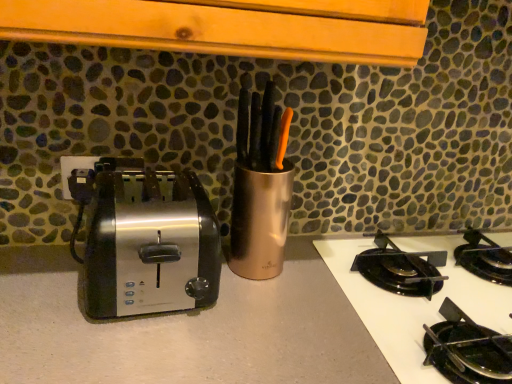
This screenshot has width=512, height=384. Find the location of `satin finish countertop at center`. satin finish countertop at center is located at coordinates (185, 329).

The height and width of the screenshot is (384, 512). I want to click on satin metallic toaster at left, so click(x=144, y=238).

In order to click on counter top in front of the satin metallic toaster at left in this screenshot , I will do `click(185, 329)`.

Which object is closer to the camera taking this photo, satin metallic toaster at left or satin finish countertop at center?

satin finish countertop at center is closer to the camera.

Choose the correct answer: Is satin metallic toaster at left inside satin finish countertop at center or outside it?

The correct answer is: outside.

Could you tell me if black glass cooktop at lower right is facing satin metallic toaster at left?

No.

From the picture: From the image's perspective, which one is positioned higher, black glass cooktop at lower right or satin metallic toaster at left?

satin metallic toaster at left, from the image's perspective.

Can you confirm if black glass cooktop at lower right is shorter than satin metallic toaster at left?

Indeed, black glass cooktop at lower right has a lesser height compared to satin metallic toaster at left.

How different are the orientations of satin finish countertop at center and satin metallic toaster at left in degrees?

satin finish countertop at center and satin metallic toaster at left are facing 0.00133 degrees away from each other.

Between satin finish countertop at center and satin metallic toaster at left, which one appears on the left side from the viewer's perspective?

Positioned to the left is satin metallic toaster at left.

Is point (64, 249) closer or farther from the camera than point (191, 174)?

Point (64, 249) is positioned farther from the camera compared to point (191, 174).

Is the depth of satin metallic toaster at left less than that of black glass cooktop at lower right?

No.

In the scene shown: From the image's perspective, is satin metallic toaster at left beneath black glass cooktop at lower right?

Actually, satin metallic toaster at left appears above black glass cooktop at lower right in the image.

Could you tell me if satin metallic toaster at left is turned towards black glass cooktop at lower right?

No.

Looking at the image, does satin finish countertop at center seem bigger or smaller compared to black glass cooktop at lower right?

Clearly, satin finish countertop at center is larger in size than black glass cooktop at lower right.

Considering the relative positions of satin finish countertop at center and black glass cooktop at lower right in the image provided, is satin finish countertop at center to the left or to the right of black glass cooktop at lower right?

In the image, satin finish countertop at center appears on the left side of black glass cooktop at lower right.

Is satin finish countertop at center looking in the opposite direction of black glass cooktop at lower right?

That's not correct — satin finish countertop at center is not looking away from black glass cooktop at lower right.

Is point (388, 313) less distant than point (102, 324)?

No, (388, 313) is behind (102, 324).

Is satin finish countertop at center at the back of black glass cooktop at lower right?

No.

Who is taller, black glass cooktop at lower right or satin finish countertop at center?

With more height is satin finish countertop at center.

Based on their sizes in the image, would you say black glass cooktop at lower right is bigger or smaller than satin finish countertop at center?

black glass cooktop at lower right is smaller than satin finish countertop at center.

Where is `counter top lying below the satin metallic toaster at left (from the image's perspective)`? counter top lying below the satin metallic toaster at left (from the image's perspective) is located at coordinates (185, 329).

I want to click on toaster located above the black glass cooktop at lower right (from a real-world perspective), so click(144, 238).

Estimate the real-world distances between objects in this image. Which object is closer to satin metallic toaster at left, black glass cooktop at lower right or satin finish countertop at center?

satin finish countertop at center is positioned closer to the anchor satin metallic toaster at left.

Estimate the real-world distances between objects in this image. Which object is closer to satin finish countertop at center, black glass cooktop at lower right or satin metallic toaster at left?

satin metallic toaster at left lies closer to satin finish countertop at center than the other object.

When comparing their distances from black glass cooktop at lower right, does satin metallic toaster at left or satin finish countertop at center seem further?

satin metallic toaster at left is further to black glass cooktop at lower right.

Estimate the real-world distances between objects in this image. Which object is further from satin metallic toaster at left, satin finish countertop at center or black glass cooktop at lower right?

black glass cooktop at lower right is positioned further to the anchor satin metallic toaster at left.

Consider the image. Looking at the image, which one is located closer to satin finish countertop at center, satin metallic toaster at left or black glass cooktop at lower right?

satin metallic toaster at left lies closer to satin finish countertop at center than the other object.

When comparing their distances from black glass cooktop at lower right, does satin finish countertop at center or satin metallic toaster at left seem closer?

satin finish countertop at center is positioned closer to the anchor black glass cooktop at lower right.

Find the location of `counter top between satin metallic toaster at left and black glass cooktop at lower right from left to right`. counter top between satin metallic toaster at left and black glass cooktop at lower right from left to right is located at coordinates (185, 329).